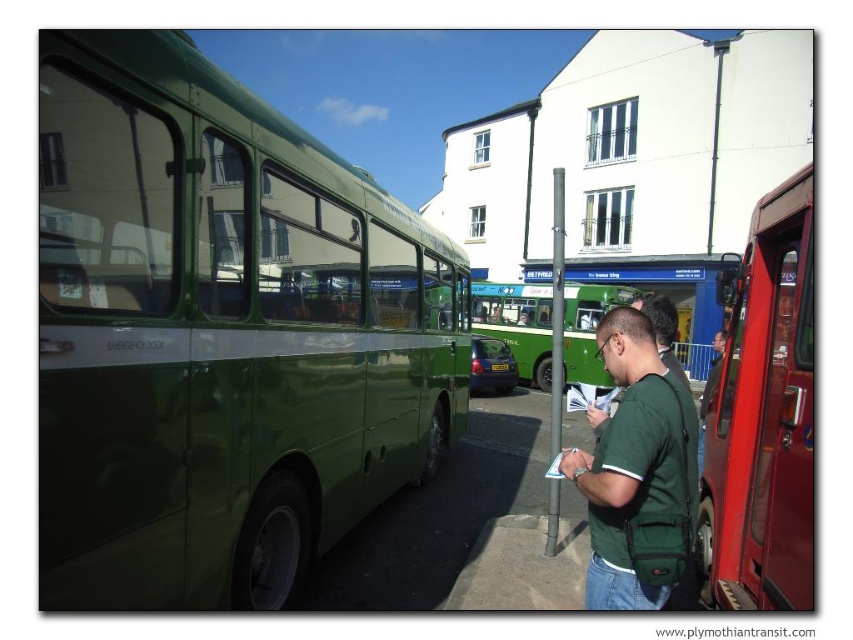
Is green matte bus at center thinner than green plastic bus stop at center?

In fact, green matte bus at center might be wider than green plastic bus stop at center.

What do you see at coordinates (517, 324) in the screenshot? This screenshot has width=853, height=640. I see `green matte bus at center` at bounding box center [517, 324].

Who is more distant from viewer, (547, 369) or (641, 284)?

Positioned behind is point (641, 284).

Find the location of a particular element. Image resolution: width=853 pixels, height=640 pixels. green matte bus at center is located at coordinates (517, 324).

Is point (793, 195) closer to viewer compared to point (601, 301)?

Yes, point (793, 195) is closer to viewer.

Based on the photo, between metallic red bus at right and green matte bus at center, which one has more height?

green matte bus at center is taller.

Does point (758, 582) lie behind point (474, 304)?

No, it is not.

The height and width of the screenshot is (640, 853). I want to click on metallic red bus at right, so click(763, 417).

Is metallic red bus at right to the right of green matte shirt at center from the viewer's perspective?

Indeed, metallic red bus at right is positioned on the right side of green matte shirt at center.

Which is below, metallic red bus at right or green matte shirt at center?

metallic red bus at right is lower down.

This screenshot has height=640, width=853. What do you see at coordinates (763, 417) in the screenshot?
I see `metallic red bus at right` at bounding box center [763, 417].

Find the location of a particular element. metallic red bus at right is located at coordinates (763, 417).